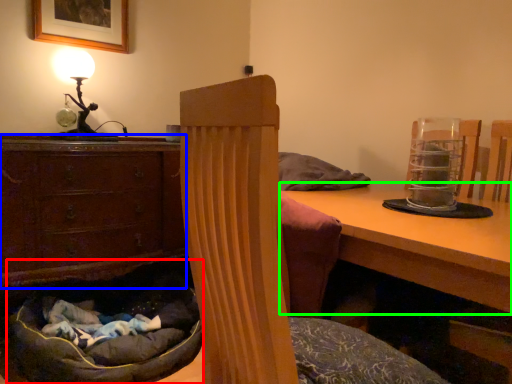
Question: Based on their relative distances, which object is nearer to bean bag chair (highlighted by a red box)? Choose from chest of drawers (highlighted by a blue box) and table (highlighted by a green box).

Choices:
 (A) chest of drawers
 (B) table

Answer: (A)